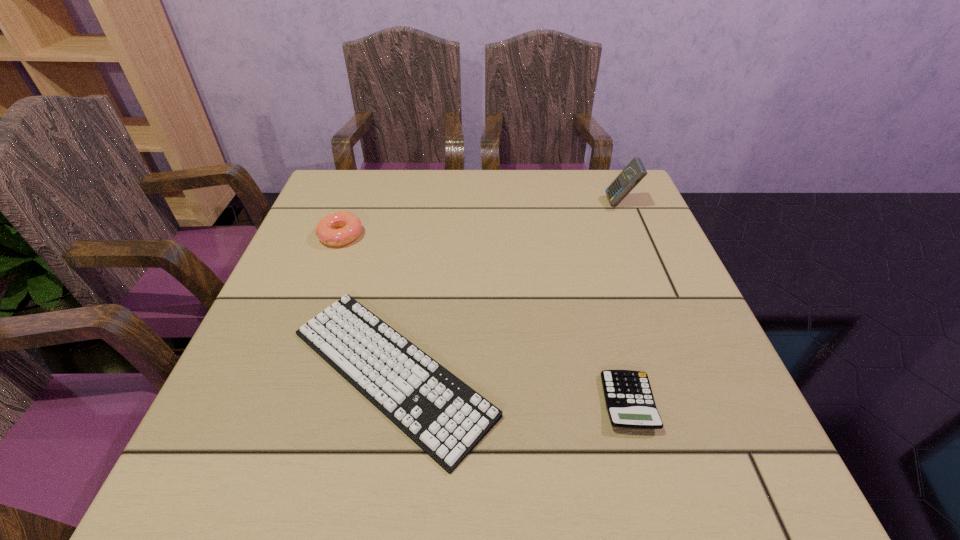
In the image, there is a desktop. At what (x,y) coordinates should I click in order to perform the action: click on vacant space at the near edge. Please return your answer as a coordinate pair (x, y). This screenshot has width=960, height=540. Looking at the image, I should click on (580, 470).

In order to click on vacant space at the left edge of the desktop in this screenshot , I will do `click(328, 306)`.

Locate an element on the screen. Image resolution: width=960 pixels, height=540 pixels. vacant space at the right edge of the desktop is located at coordinates (606, 244).

Where is `free space at the near left corner of the desktop`? free space at the near left corner of the desktop is located at coordinates (263, 460).

I want to click on free spot at the far right corner of the desktop, so click(x=606, y=213).

I want to click on free space between the second farthest object and the left calculator, so click(485, 319).

I want to click on free space that is in between the rightmost object and the computer keyboard, so click(x=506, y=287).

Identify the location of empty space that is in between the doughnut and the computer keyboard. (366, 304).

What are the coordinates of `free space between the computer keyboard and the tallest object` in the screenshot? It's located at (506, 287).

You are a GUI agent. You are given a task and a screenshot of the screen. Output one action in this format:
    pyautogui.click(x=<x>, y=<y>)
    Task: Click on the free spot between the computer keyboard and the tallest object
    
    Given the screenshot: What is the action you would take?
    pyautogui.click(x=506, y=287)